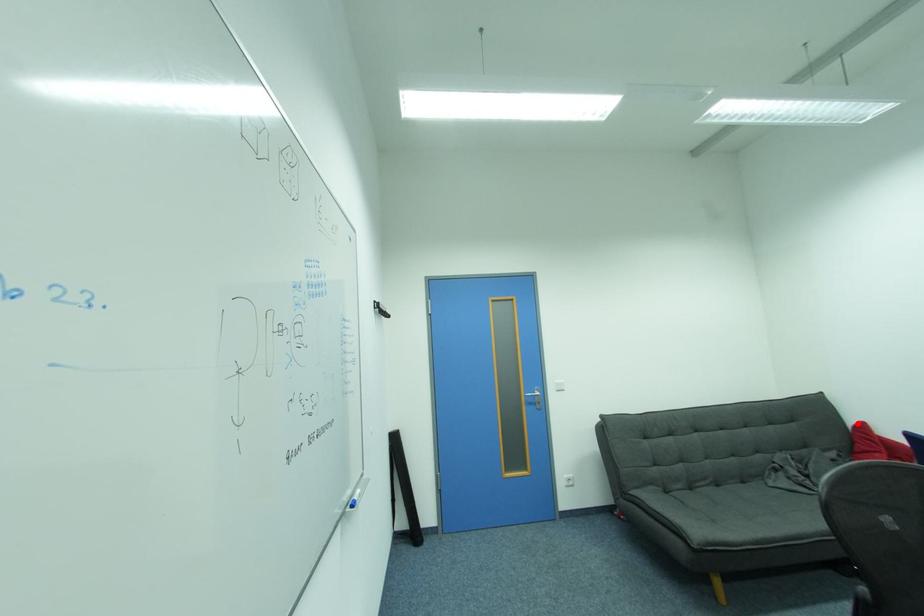
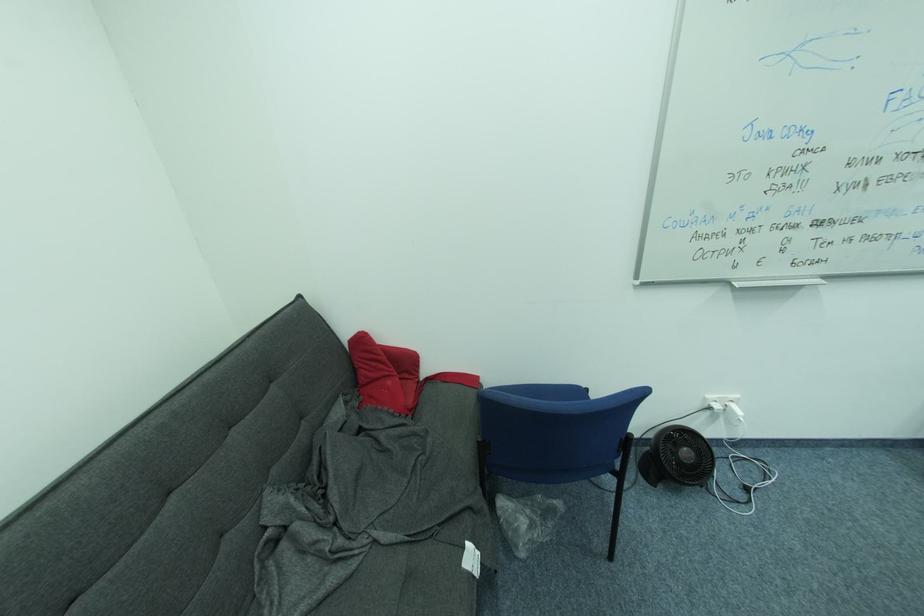
Find the pixel in the second image that matches the highlighted location in the first image.

(353, 336)